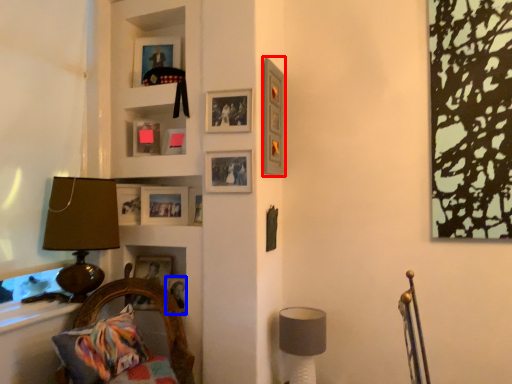
Question: Which object is closer to the camera taking this photo, picture frame (highlighted by a red box) or picture frame (highlighted by a blue box)?

Choices:
 (A) picture frame
 (B) picture frame

Answer: (A)